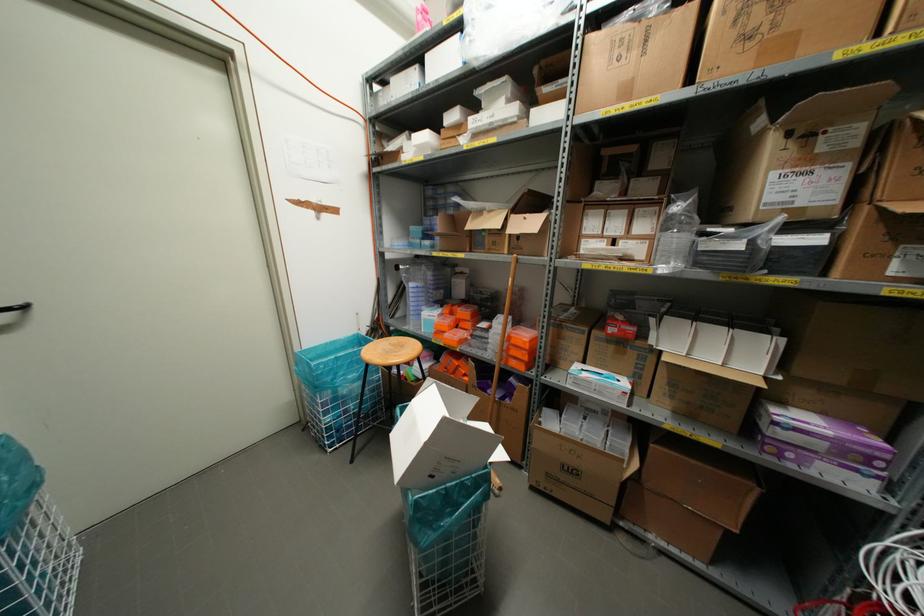
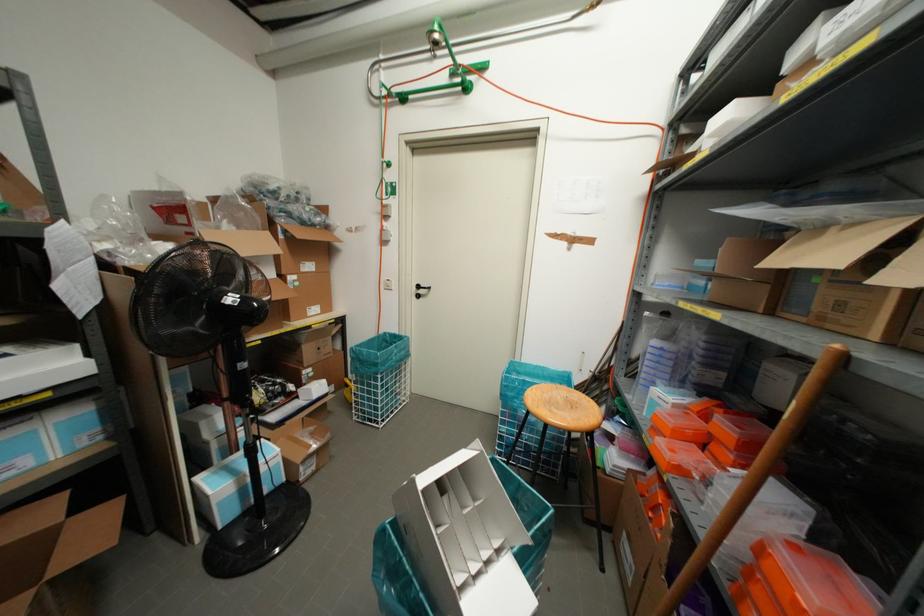
The point at (463, 312) is marked in the first image. Where is the corresponding point in the second image?

(723, 427)